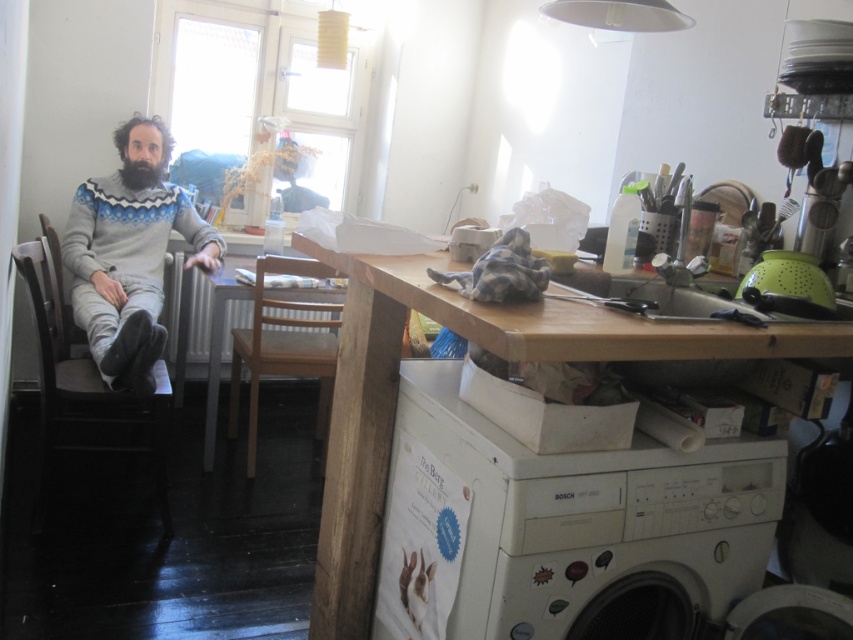
Consider the image. You are trying to decide where to place a new laundry basket in the kitchen. The white plastic washing machine at lower right and the knitted sweater at left are already present. Which object takes up more space in the kitchen?

The knitted sweater at left takes up more space than the white plastic washing machine at lower right because the white plastic washing machine at lower right is smaller than knitted sweater at left.

You are trying to decide where to place a new plant stand in the kitchen. The stand requires a spot that is above both the gray fabric chair at left and the wooden chair at center. Is there a suitable location available?

The gray fabric chair at left is located below the wooden chair at center, so the space above the wooden chair at center would be a suitable location for the plant stand since it is positioned higher than the gray fabric chair at left.